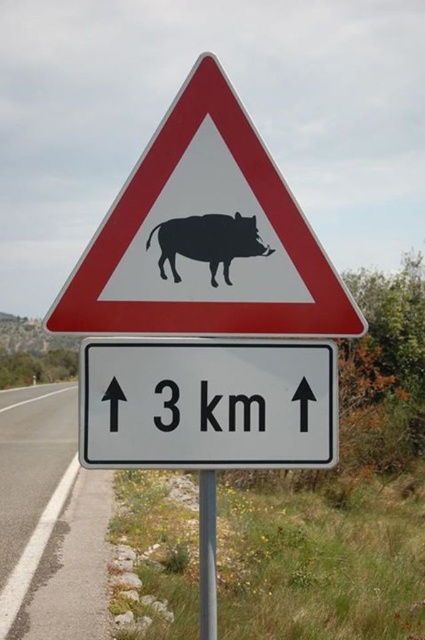
You are driving a car and see the white plastic sign at center and the white asphalt road at lower left. Which object is nearer to you as you look ahead through your windshield?

The white plastic sign at center is closer to the viewer than the white asphalt road at lower left, so the white plastic sign at center is nearer to you.